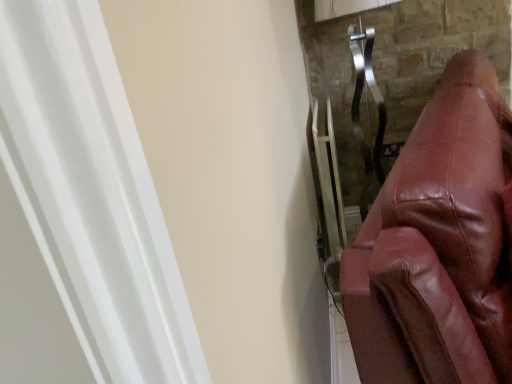
The width and height of the screenshot is (512, 384). Identify the location of shiny brown leather couch at right. (438, 246).

The width and height of the screenshot is (512, 384). Describe the element at coordinates (438, 246) in the screenshot. I see `shiny brown leather couch at right` at that location.

Where is `shiny brown leather couch at right`? shiny brown leather couch at right is located at coordinates (438, 246).